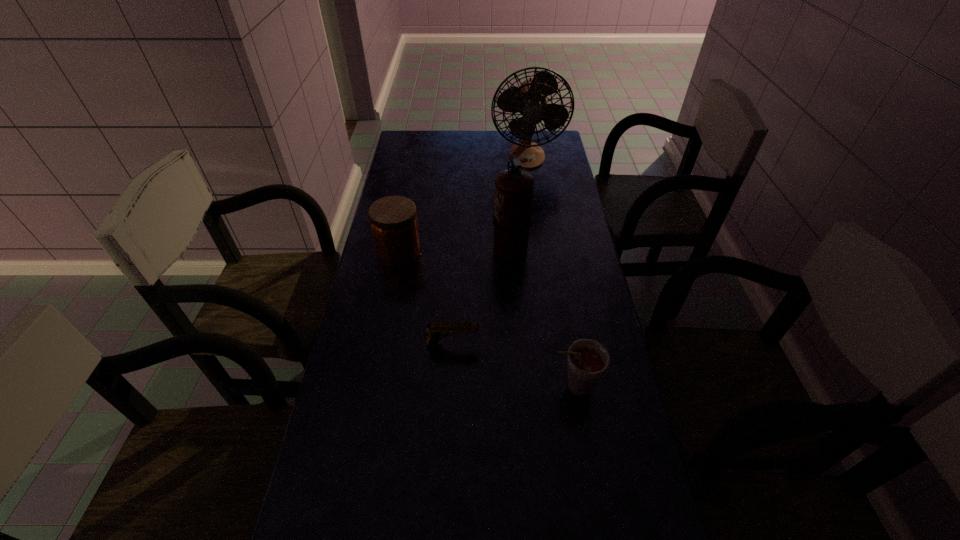
At what (x,y) coordinates should I click in order to perform the action: click on vacant region located on the drink side of the nearest object. Please return your answer as a coordinate pair (x, y). Image resolution: width=960 pixels, height=540 pixels. Looking at the image, I should click on (396, 387).

Locate an element on the screen. The image size is (960, 540). free spot located 0.250m on the drink side of the nearest object is located at coordinates (450, 387).

Where is `free space located 0.340m on the drink side of the nearest object`? Image resolution: width=960 pixels, height=540 pixels. free space located 0.340m on the drink side of the nearest object is located at coordinates (416, 387).

This screenshot has width=960, height=540. What are the coordinates of `vacant region located 0.220m on the right of the jar` in the screenshot? It's located at (487, 252).

In order to click on vacant space located at the barrel of the shortest object in this screenshot , I will do `click(601, 344)`.

The height and width of the screenshot is (540, 960). I want to click on object present at the far edge, so click(529, 99).

Identify the location of object that is at the left edge. This screenshot has height=540, width=960. (393, 220).

Where is `fan situated at the right edge`? The height and width of the screenshot is (540, 960). fan situated at the right edge is located at coordinates click(529, 99).

Locate an element on the screen. root beer at the right edge is located at coordinates pos(587,361).

Locate an element on the screen. Image resolution: width=960 pixels, height=540 pixels. object located at the far right corner is located at coordinates (529, 99).